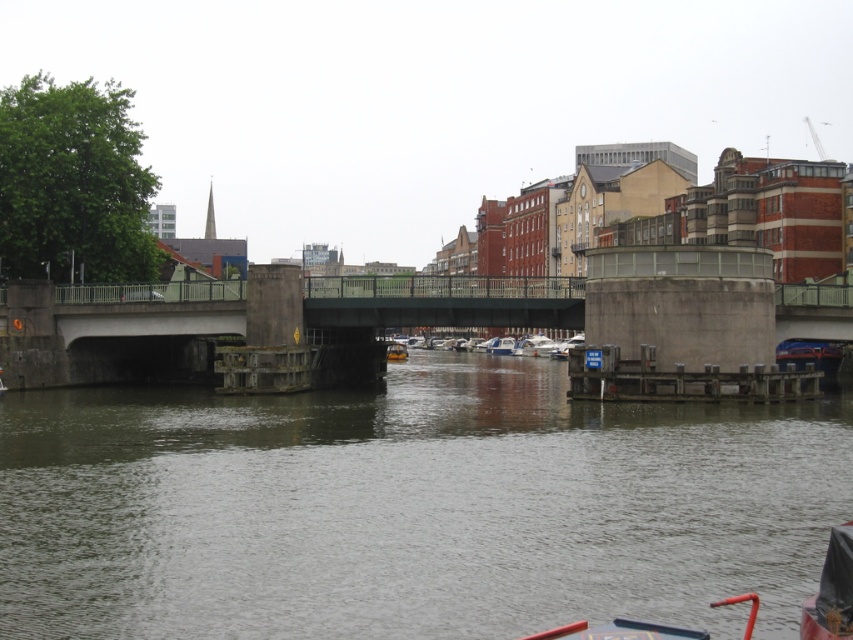
You are a photographer standing on the dock and want to capture a shot of the smooth concrete water at center and the white plastic boats at center. Based on their positions, which object should you frame first in your camera viewfinder to ensure both are in the shot?

The smooth concrete water at center is positioned on the left side of white plastic boats at center. To ensure both are in the shot, you should frame the smooth concrete water at center first since it is on the left side, allowing the white plastic boats at center to be included in the same view.

You are a tour guide leading a group of visitors on a boat tour. You have two boats available for the tour, the white plastic boats at center and the yellow rubber boat at center. The tour requires the boats to be within 15 meters of each other for communication purposes. Can both boats be used for the tour without violating the communication distance requirement?

The distance between the white plastic boats at center and the yellow rubber boat at center is 16.53 meters, which exceeds the 15 meters requirement. Therefore, the boats cannot be used together without violating the communication distance requirement.